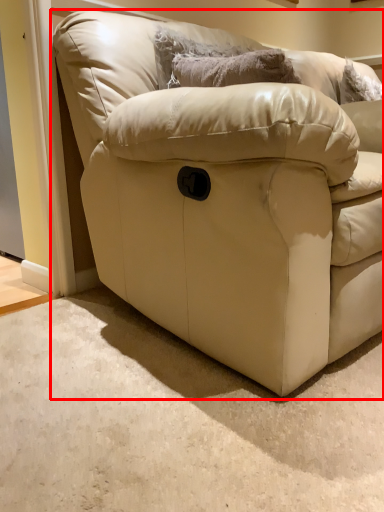
Question: From the image, what is the correct spatial relationship of studio couch (annotated by the red box) in relation to pillow?

Choices:
 (A) right
 (B) left

Answer: (A)